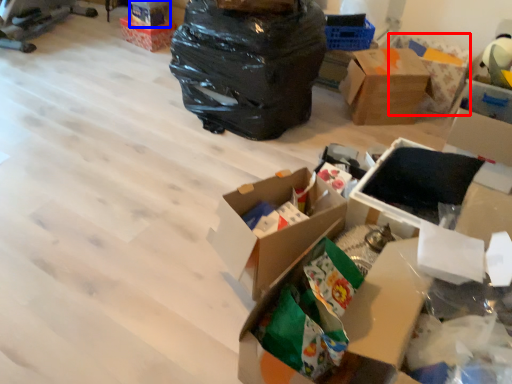
Question: Which of the following is the closest to the observer, cardboard box (highlighted by a red box) or storage box (highlighted by a blue box)?

Choices:
 (A) cardboard box
 (B) storage box

Answer: (A)